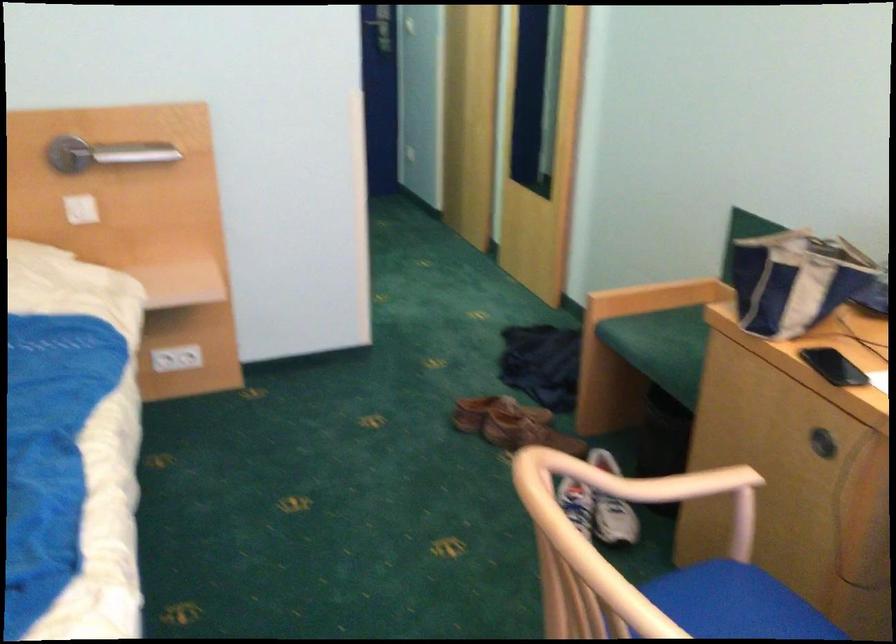
In order to click on wooden chair armrest in this screenshot , I will do `click(609, 542)`.